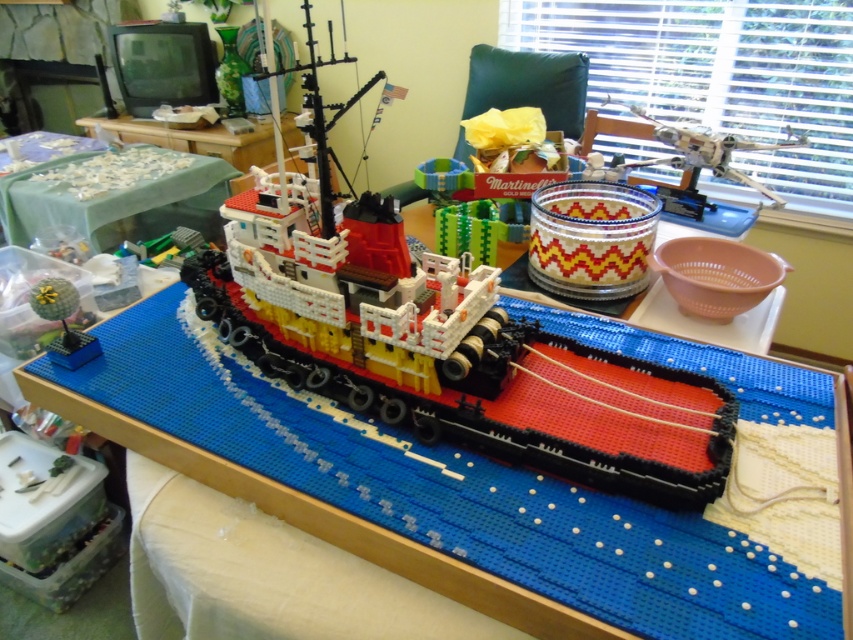
Question: Which point is farther from the camera taking this photo?

Choices:
 (A) (35, 300)
 (B) (677, 208)
 (C) (225, 298)

Answer: (B)

Question: Among these points, which one is nearest to the camera?

Choices:
 (A) (59, 195)
 (B) (798, 145)
 (C) (224, 483)

Answer: (C)

Question: Based on their relative distances, which object is nearer to the translucent plastic x-wing fighter at upper right?

Choices:
 (A) blue plastic table at center
 (B) green fabric table at upper left
 (C) green matte plant at lower left

Answer: (A)

Question: Can you confirm if green fabric table at upper left is positioned to the right of translucent plastic x-wing fighter at upper right?

Choices:
 (A) no
 (B) yes

Answer: (A)

Question: Is green fabric table at upper left positioned before beaded glass jar at center?

Choices:
 (A) no
 (B) yes

Answer: (A)

Question: Is brick-like lego ship at center wider than translucent plastic x-wing fighter at upper right?

Choices:
 (A) yes
 (B) no

Answer: (A)